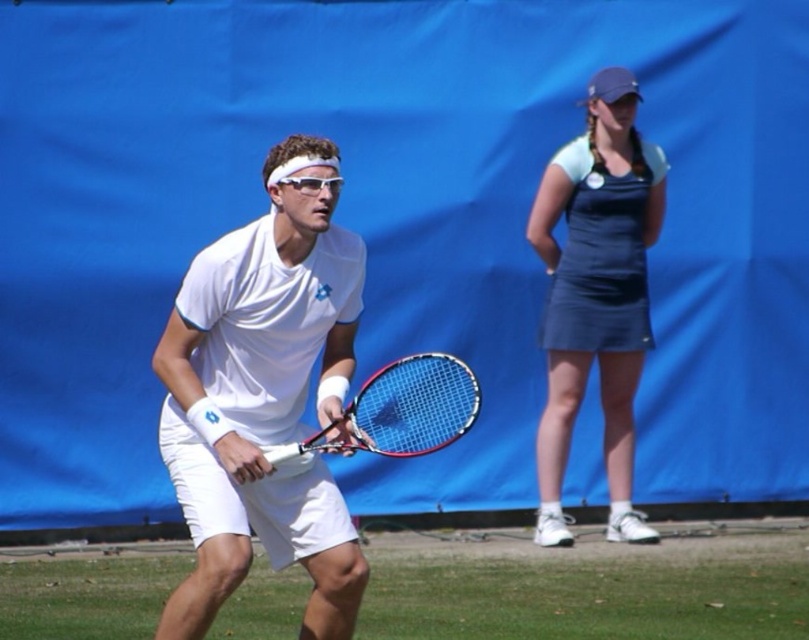
Question: Is white matte tennis racket at center above matte blue racket at center?

Choices:
 (A) no
 (B) yes

Answer: (B)

Question: Does white matte tennis racket at center lie in front of matte blue racket at center?

Choices:
 (A) yes
 (B) no

Answer: (A)

Question: Considering the real-world distances, which object is farthest from the matte blue racket at center?

Choices:
 (A) dark blue fabric dress at upper right
 (B) white matte tennis racket at center

Answer: (A)

Question: Considering the real-world distances, which object is closest to the matte blue racket at center?

Choices:
 (A) white matte tennis racket at center
 (B) dark blue fabric dress at upper right

Answer: (A)

Question: Which of these objects is positioned closest to the white matte tennis racket at center?

Choices:
 (A) matte blue racket at center
 (B) dark blue fabric dress at upper right

Answer: (A)

Question: From the image, what is the correct spatial relationship of dark blue fabric dress at upper right in relation to matte blue racket at center?

Choices:
 (A) left
 (B) right

Answer: (B)